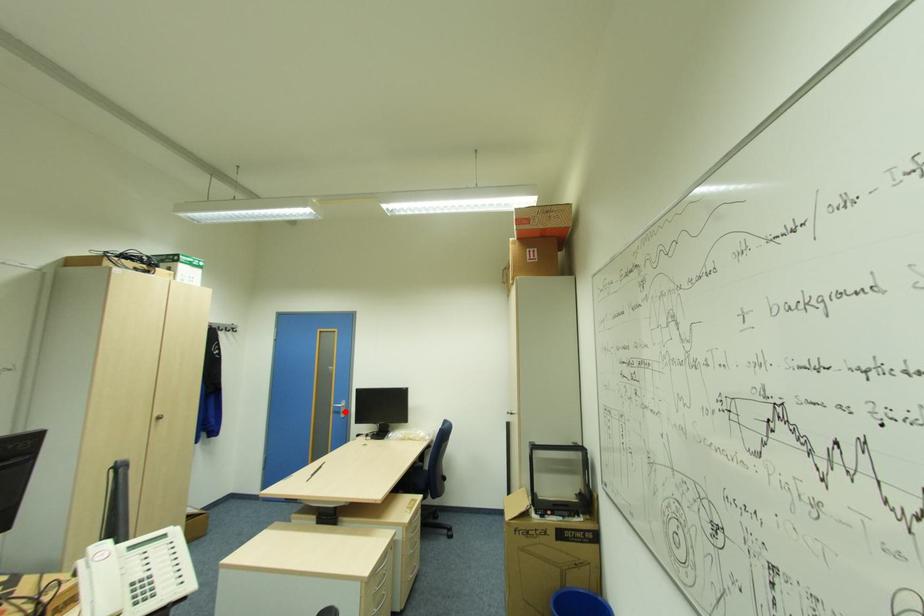
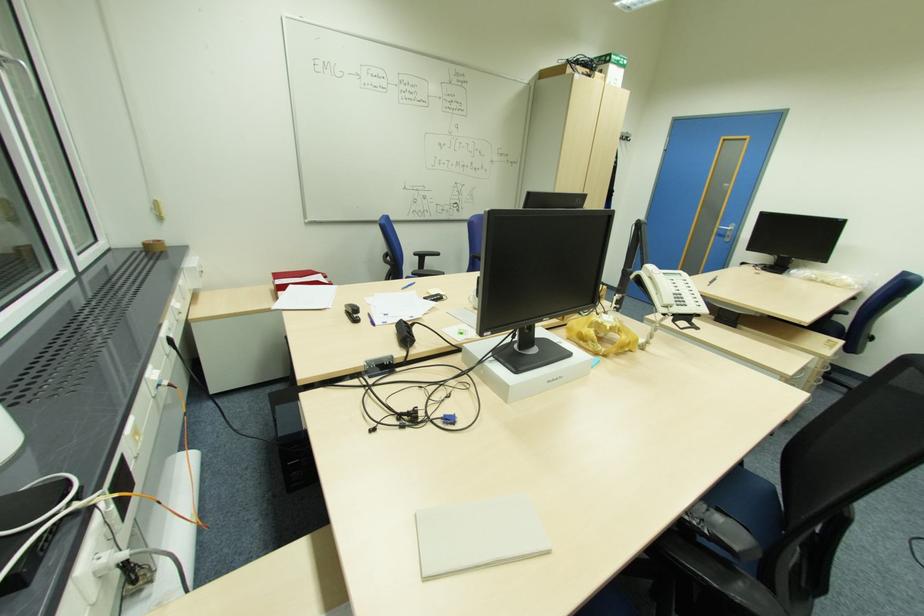
Question: A red point is marked in image1. In image2, is the corresponding 3D point closer to the camera or farther? Reply with the corresponding letter.

Choices:
 (A) The corresponding 3D point is closer.
 (B) The corresponding 3D point is farther.

Answer: (A)